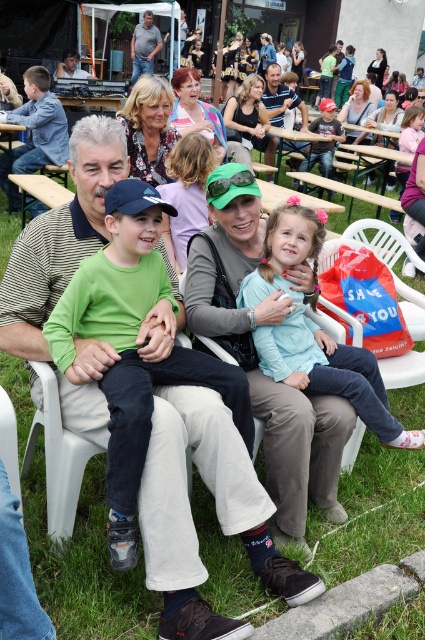
Question: Does light blue fabric shirt at center appear on the left side of denim jeans at upper center?

Choices:
 (A) yes
 (B) no

Answer: (B)

Question: Which of the following is the closest to the observer?

Choices:
 (A) light blue fabric shirt at center
 (B) green cotton shirt at center
 (C) smooth brown shirt at center
 (D) denim jeans at upper center

Answer: (B)

Question: Which point is farther from the camera taking this photo?

Choices:
 (A) (254, 339)
 (B) (238, 376)

Answer: (A)

Question: From the image, what is the correct spatial relationship of light blue fabric shirt at center in relation to denim jeans at upper center?

Choices:
 (A) left
 (B) right

Answer: (B)

Question: In this image, where is smooth brown shirt at center located relative to denim jeans at upper center?

Choices:
 (A) left
 (B) right

Answer: (B)

Question: Which point is closer to the camera taking this photo?

Choices:
 (A) (110, 368)
 (B) (295, 307)
 (C) (266, 88)

Answer: (A)